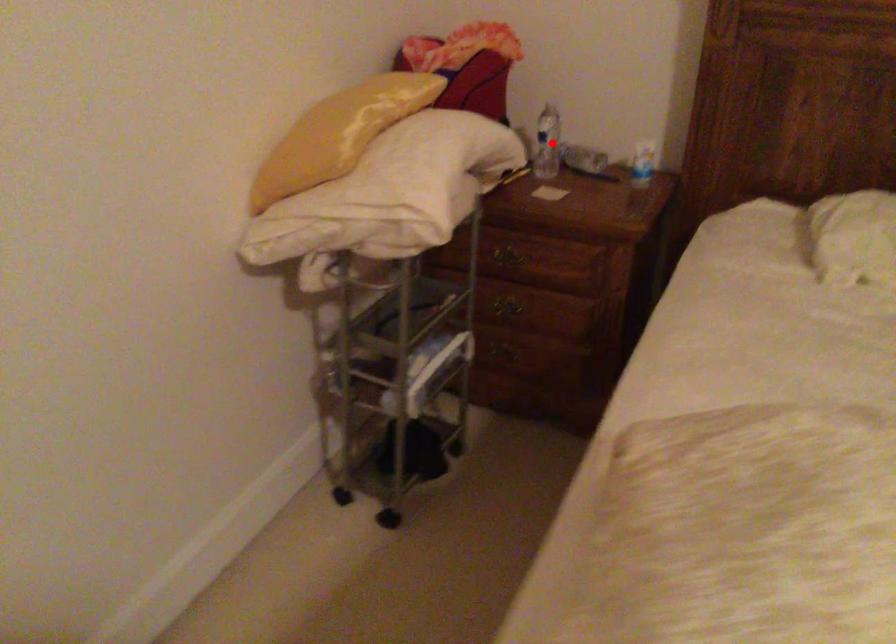
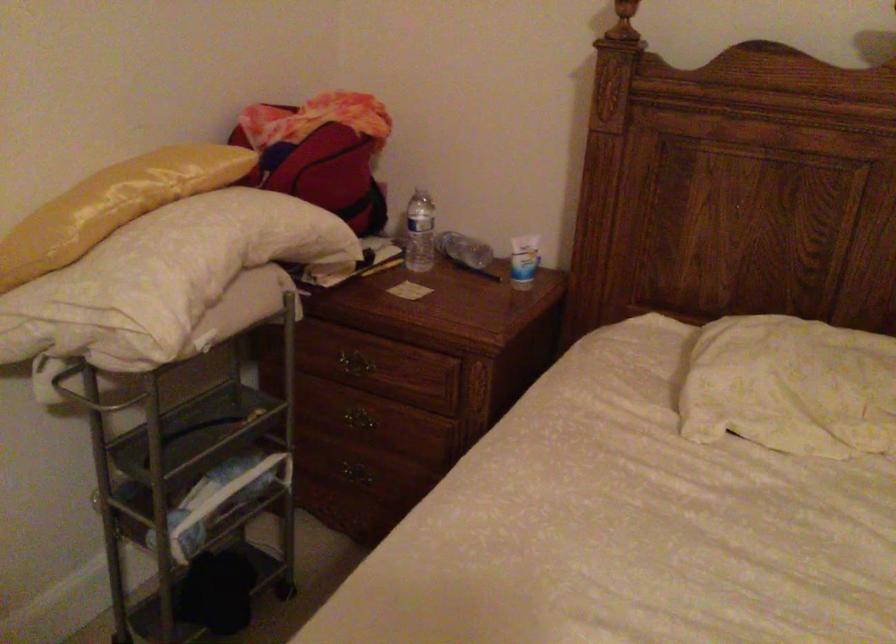
Question: I am providing you with two images of the same scene from different viewpoints. A red point is shown in image1. For the corresponding object point in image2, is it positioned nearer or farther from the camera?

Choices:
 (A) Nearer
 (B) Farther

Answer: (A)